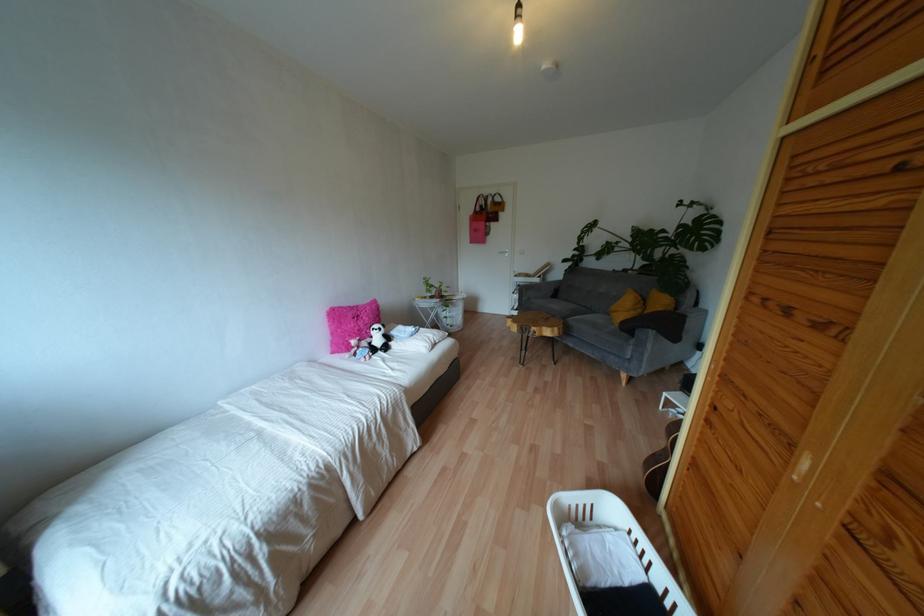
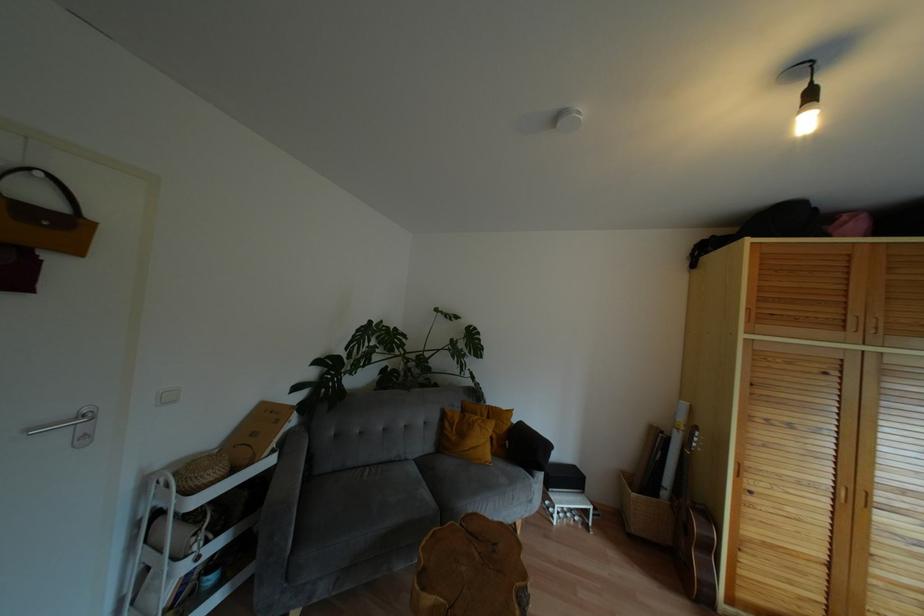
Where in the second image is the point corresponding to (x=503, y=209) from the first image?

(78, 251)